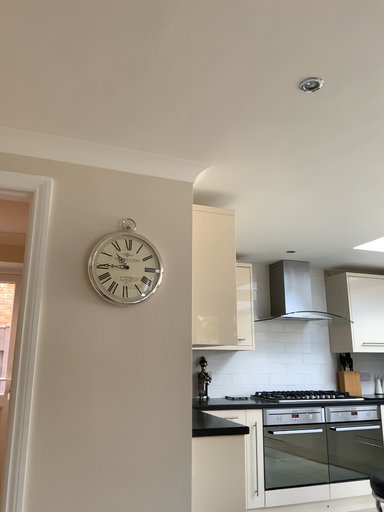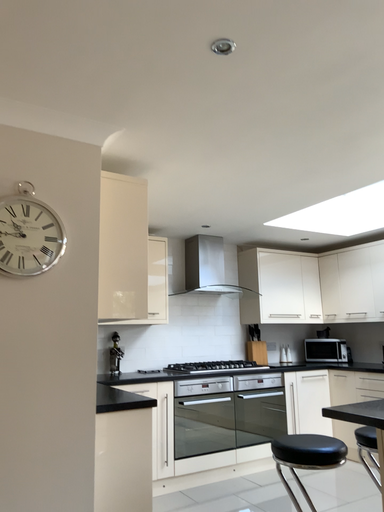
Question: Which way did the camera rotate in the video?

Choices:
 (A) rotated right
 (B) rotated left

Answer: (A)